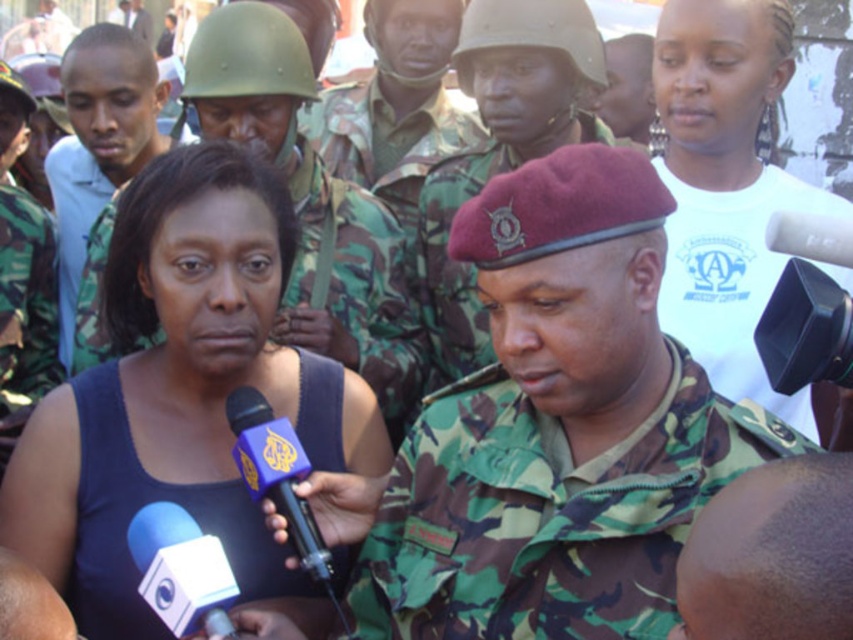
Which of these two, dark skin bald head at center or matte green helmet at upper left, stands taller?

dark skin bald head at center is taller.

Which is above, dark skin bald head at center or matte green helmet at upper left?

matte green helmet at upper left is above.

This screenshot has height=640, width=853. What do you see at coordinates (770, 556) in the screenshot?
I see `dark skin bald head at center` at bounding box center [770, 556].

Locate an element on the screen. This screenshot has width=853, height=640. dark skin bald head at center is located at coordinates (770, 556).

The image size is (853, 640). Find the location of `camo fabric uniform at center`. camo fabric uniform at center is located at coordinates (547, 513).

Does camo fabric uniform at center have a lesser height compared to blue matte microphone at lower left?

In fact, camo fabric uniform at center may be taller than blue matte microphone at lower left.

Find the location of `camo fabric uniform at center`. camo fabric uniform at center is located at coordinates (547, 513).

You are a GUI agent. You are given a task and a screenshot of the screen. Output one action in this format:
    pyautogui.click(x=<x>, y=<y>)
    Task: Click on the camo fabric uniform at center
    
    Given the screenshot: What is the action you would take?
    pyautogui.click(x=547, y=513)

Consider the image. Which is above, camo fabric uniform at center or purple fabric microphone at center?

camo fabric uniform at center is above.

Does camo fabric uniform at center come behind purple fabric microphone at center?

No, camo fabric uniform at center is in front of purple fabric microphone at center.

Which is behind, point (415, 586) or point (299, 506)?

Positioned behind is point (415, 586).

You are a GUI agent. You are given a task and a screenshot of the screen. Output one action in this format:
    pyautogui.click(x=<x>, y=<y>)
    Task: Click on the camo fabric uniform at center
    Image resolution: width=853 pixels, height=640 pixels.
    Given the screenshot: What is the action you would take?
    pyautogui.click(x=547, y=513)